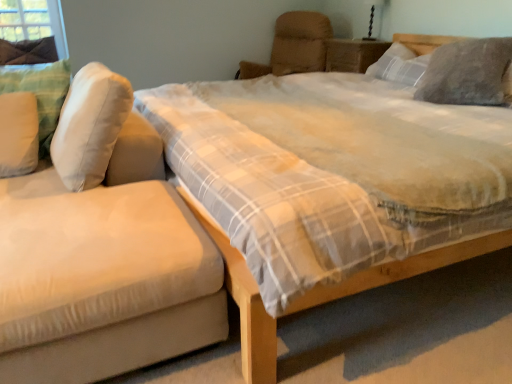
Question: Is suede-like beige studio couch at left positioned with its back to wooden nightstand at upper center?

Choices:
 (A) yes
 (B) no

Answer: (A)

Question: From the image's perspective, is suede-like beige studio couch at left on top of wooden nightstand at upper center?

Choices:
 (A) no
 (B) yes

Answer: (A)

Question: From a real-world perspective, is suede-like beige studio couch at left beneath wooden nightstand at upper center?

Choices:
 (A) no
 (B) yes

Answer: (B)

Question: Does suede-like beige studio couch at left turn towards wooden nightstand at upper center?

Choices:
 (A) yes
 (B) no

Answer: (B)

Question: Is suede-like beige studio couch at left outside of wooden nightstand at upper center?

Choices:
 (A) yes
 (B) no

Answer: (A)

Question: From a real-world perspective, is black glass table lamp at upper right above or below beige fabric armchair at upper center?

Choices:
 (A) below
 (B) above

Answer: (B)

Question: From the image's perspective, is black glass table lamp at upper right positioned above or below beige fabric armchair at upper center?

Choices:
 (A) above
 (B) below

Answer: (A)

Question: Would you say black glass table lamp at upper right is to the left or to the right of beige fabric armchair at upper center in the picture?

Choices:
 (A) left
 (B) right

Answer: (B)

Question: Considering their positions, is black glass table lamp at upper right located in front of or behind beige fabric armchair at upper center?

Choices:
 (A) behind
 (B) front

Answer: (A)

Question: From a real-world perspective, is white soft pillow at left, positioned as the first pillow in left-to-right order, positioned above or below white fabric pillow at left, the third pillow from the right?

Choices:
 (A) below
 (B) above

Answer: (A)

Question: In terms of height, does white soft pillow at left, positioned as the first pillow in left-to-right order, look taller or shorter compared to white fabric pillow at left, the third pillow from the right?

Choices:
 (A) tall
 (B) short

Answer: (A)

Question: Is point (37, 77) positioned closer to the camera than point (74, 130)?

Choices:
 (A) farther
 (B) closer

Answer: (A)

Question: From the image's perspective, is white soft pillow at left, which is counted as the 4th pillow, starting from the right, positioned above or below white fabric pillow at left, the second pillow from the left?

Choices:
 (A) below
 (B) above

Answer: (B)

Question: In the image, is black glass table lamp at upper right on the left side or the right side of gray fuzzy pillow at upper right, the 4th pillow from the left?

Choices:
 (A) left
 (B) right

Answer: (A)

Question: In terms of width, does black glass table lamp at upper right look wider or thinner when compared to gray fuzzy pillow at upper right, the 1th pillow positioned from the right?

Choices:
 (A) wide
 (B) thin

Answer: (B)